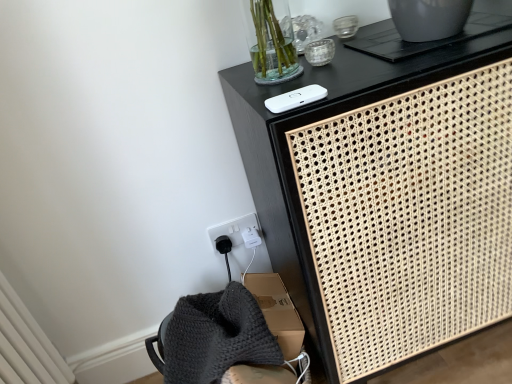
Question: Considering the relative sizes of white matte ipod at upper center and white woven cabinet at upper right in the image provided, is white matte ipod at upper center taller than white woven cabinet at upper right?

Choices:
 (A) yes
 (B) no

Answer: (B)

Question: Would you consider white matte ipod at upper center to be distant from white woven cabinet at upper right?

Choices:
 (A) yes
 (B) no

Answer: (B)

Question: Can you confirm if white matte ipod at upper center is shorter than white woven cabinet at upper right?

Choices:
 (A) yes
 (B) no

Answer: (A)

Question: Are white matte ipod at upper center and white woven cabinet at upper right making contact?

Choices:
 (A) no
 (B) yes

Answer: (A)

Question: Is white matte ipod at upper center not within white woven cabinet at upper right?

Choices:
 (A) no
 (B) yes

Answer: (A)

Question: Is the position of white matte ipod at upper center more distant than that of white woven cabinet at upper right?

Choices:
 (A) yes
 (B) no

Answer: (A)

Question: From the image's perspective, is white woven cabinet at upper right under white matte ipod at upper center?

Choices:
 (A) no
 (B) yes

Answer: (B)

Question: Considering the relative sizes of white woven cabinet at upper right and white matte ipod at upper center in the image provided, is white woven cabinet at upper right smaller than white matte ipod at upper center?

Choices:
 (A) yes
 (B) no

Answer: (B)

Question: Is white woven cabinet at upper right positioned behind white matte ipod at upper center?

Choices:
 (A) no
 (B) yes

Answer: (A)

Question: From the image's perspective, is white woven cabinet at upper right over white matte ipod at upper center?

Choices:
 (A) no
 (B) yes

Answer: (A)

Question: Considering the relative sizes of white woven cabinet at upper right and white matte ipod at upper center in the image provided, is white woven cabinet at upper right thinner than white matte ipod at upper center?

Choices:
 (A) no
 (B) yes

Answer: (A)

Question: Does white woven cabinet at upper right appear on the left side of white matte ipod at upper center?

Choices:
 (A) yes
 (B) no

Answer: (B)

Question: Is white woven cabinet at upper right taller or shorter than white matte ipod at upper center?

Choices:
 (A) tall
 (B) short

Answer: (A)